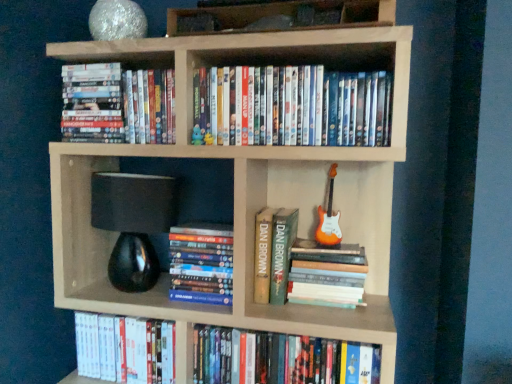
Locate an element on the screen. blank space above white glossy dvds at upper left, positioned as the 1th book in top-to-bottom order (from a real-world perspective) is located at coordinates (125, 61).